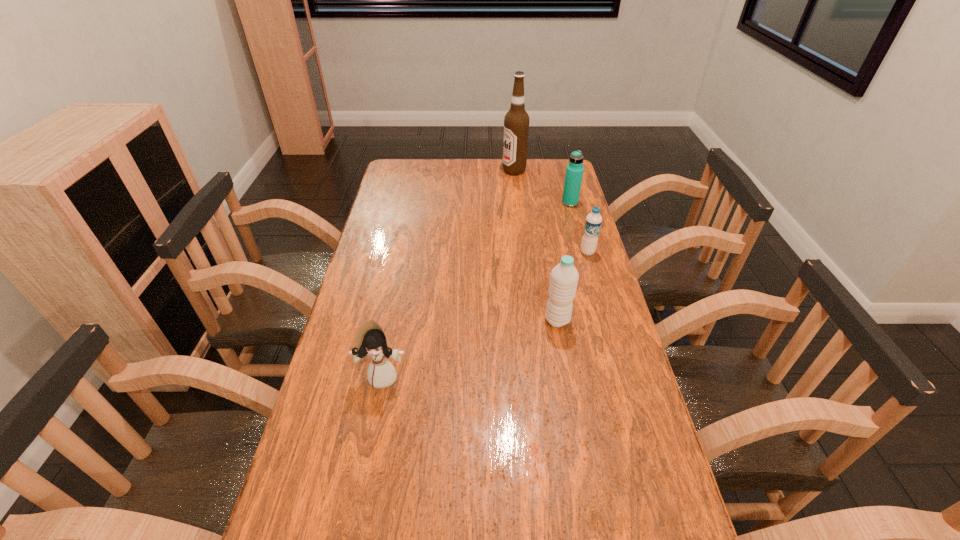
At what (x,y) coordinates should I click in order to perform the action: click on vacant space at the right edge. Please return your answer as a coordinate pair (x, y). The image size is (960, 540). Looking at the image, I should click on (595, 387).

You are a GUI agent. You are given a task and a screenshot of the screen. Output one action in this format:
    pyautogui.click(x=<x>, y=<y>)
    Task: Click on the vacant space at the far right corner of the desktop
    
    Given the screenshot: What is the action you would take?
    pyautogui.click(x=551, y=161)

I want to click on free space between the shortest object and the tallest object, so click(x=551, y=211).

Find the location of a particular element. The height and width of the screenshot is (540, 960). blank region between the leftmost object and the nearest water bottle is located at coordinates (470, 348).

Find the location of a particular element. free area in between the tallest object and the doll is located at coordinates [448, 273].

What are the coordinates of `vacant region between the leftmost water bottle and the doll` in the screenshot? It's located at (470, 348).

At what (x,y) coordinates should I click in order to perform the action: click on empty location between the shortest water bottle and the nearest object. Please return your answer as a coordinate pair (x, y). This screenshot has width=960, height=540. Looking at the image, I should click on (486, 314).

Identify the location of vacant point located between the nearest object and the second farthest object. This screenshot has height=540, width=960. (477, 289).

Where is `empty space that is in between the doll and the fourth nearest object`? The width and height of the screenshot is (960, 540). empty space that is in between the doll and the fourth nearest object is located at coordinates (477, 289).

Point out which object is positioned as the third nearest to the fourth farthest object. Please provide its 2D coordinates. Your answer should be formatted as a tuple, i.e. [(x, y)], where the tuple contains the x and y coordinates of a point satisfying the conditions above.

[(574, 172)]